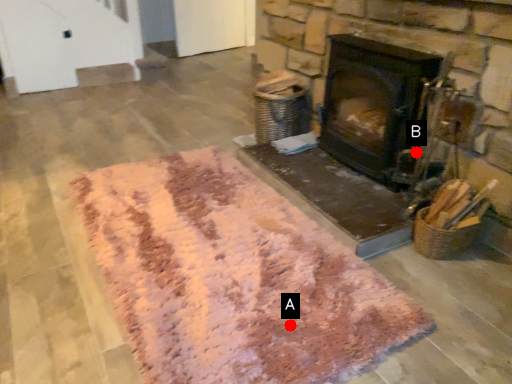
Question: Two points are circled on the image, labeled by A and B beside each circle. Which point is further to the camera?

Choices:
 (A) A is further
 (B) B is further

Answer: (B)